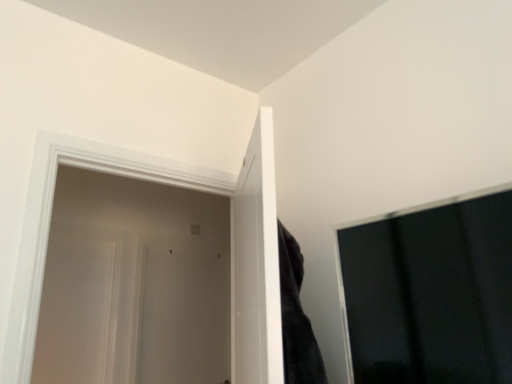
Question: From a real-world perspective, relative to white glossy door at left, the first door in the right-to-left sequence, is white glossy door at left, which appears as the second door when viewed from the back, vertically above or below?

Choices:
 (A) above
 (B) below

Answer: (B)

Question: Based on their sizes in the image, would you say white glossy door at left, which is the third door from right to left, is bigger or smaller than white glossy door at left, placed as the 3th door when sorted from left to right?

Choices:
 (A) small
 (B) big

Answer: (A)

Question: Which object is the farthest from the white matte door at center, arranged as the 3th door when viewed from the front?

Choices:
 (A) white glossy door at left, placed as the 3th door when sorted from left to right
 (B) white glossy door at left, which is the third door from right to left

Answer: (A)

Question: Which of these objects is positioned farthest from the white matte door at center, positioned as the 2th door in left-to-right order?

Choices:
 (A) white glossy door at left, the first door positioned from the front
 (B) white glossy door at left, which appears as the 1th door when viewed from the left

Answer: (A)